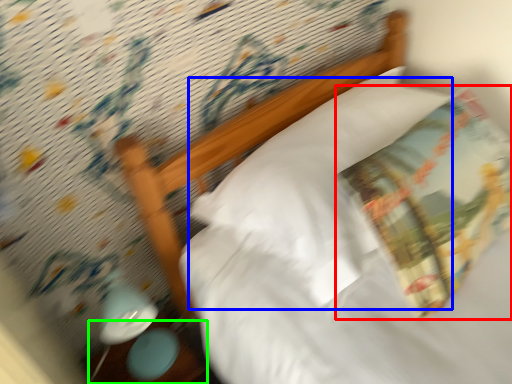
Question: Which object is positioned farthest from throw pillow (highlighted by a red box)? Select from pillow (highlighted by a blue box) and table (highlighted by a green box).

Choices:
 (A) pillow
 (B) table

Answer: (B)